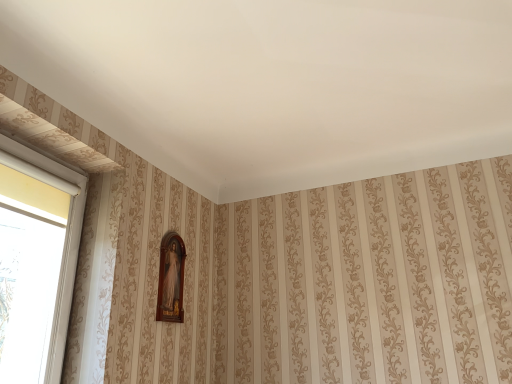
Question: From the image's perspective, is wooden frame at center located above white plastic window at left?

Choices:
 (A) yes
 (B) no

Answer: (B)

Question: Can you confirm if wooden frame at center is taller than white plastic window at left?

Choices:
 (A) no
 (B) yes

Answer: (A)

Question: Is wooden frame at center bigger than white plastic window at left?

Choices:
 (A) no
 (B) yes

Answer: (A)

Question: Can you see wooden frame at center touching white plastic window at left?

Choices:
 (A) yes
 (B) no

Answer: (B)

Question: Is wooden frame at center positioned far away from white plastic window at left?

Choices:
 (A) yes
 (B) no

Answer: (B)

Question: From a real-world perspective, is wooden frame at center located higher than white plastic window at left?

Choices:
 (A) yes
 (B) no

Answer: (A)

Question: Is white plastic window at left completely or partially outside of wooden frame at center?

Choices:
 (A) no
 (B) yes

Answer: (B)

Question: Does white plastic window at left have a greater height compared to wooden frame at center?

Choices:
 (A) yes
 (B) no

Answer: (A)

Question: Is white plastic window at left behind wooden frame at center?

Choices:
 (A) no
 (B) yes

Answer: (A)

Question: Can you confirm if white plastic window at left is shorter than wooden frame at center?

Choices:
 (A) no
 (B) yes

Answer: (A)

Question: Considering the relative positions of white plastic window at left and wooden frame at center in the image provided, is white plastic window at left to the right of wooden frame at center from the viewer's perspective?

Choices:
 (A) yes
 (B) no

Answer: (B)

Question: From a real-world perspective, is white plastic window at left on top of wooden frame at center?

Choices:
 (A) yes
 (B) no

Answer: (B)

Question: Considering the positions of white plastic window at left and wooden frame at center in the image, is white plastic window at left wider or thinner than wooden frame at center?

Choices:
 (A) thin
 (B) wide

Answer: (B)